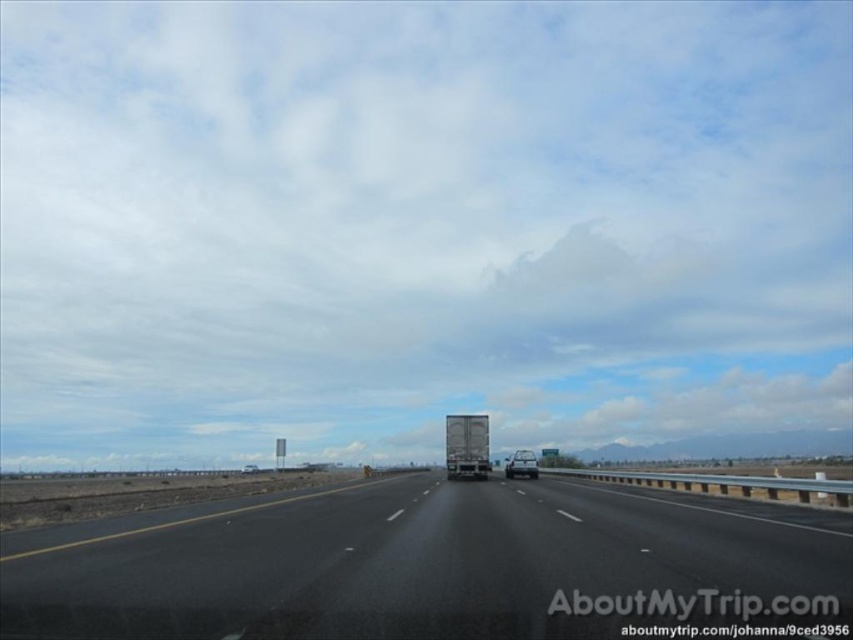
Between black asphalt highway at center and glossy silver truck at center, which one has less height?

With less height is black asphalt highway at center.

Does black asphalt highway at center have a greater width compared to glossy silver truck at center?

Yes, black asphalt highway at center is wider than glossy silver truck at center.

This screenshot has width=853, height=640. Find the location of `black asphalt highway at center`. black asphalt highway at center is located at coordinates (422, 564).

Can you confirm if black asphalt highway at center is positioned to the right of silver metallic truck at center?

In fact, black asphalt highway at center is to the left of silver metallic truck at center.

Who is more distant from viewer, (358, 516) or (454, 458)?

The point (454, 458) is more distant.

At what (x,y) coordinates should I click in order to perform the action: click on black asphalt highway at center. Please return your answer as a coordinate pair (x, y). This screenshot has height=640, width=853. Looking at the image, I should click on (422, 564).

Can you confirm if cloudy sky at upper center is positioned to the right of black asphalt highway at center?

Incorrect, cloudy sky at upper center is not on the right side of black asphalt highway at center.

Is point (231, 269) farther from viewer compared to point (392, 548)?

That is True.

This screenshot has height=640, width=853. In order to click on cloudy sky at upper center in this screenshot , I will do `click(419, 225)`.